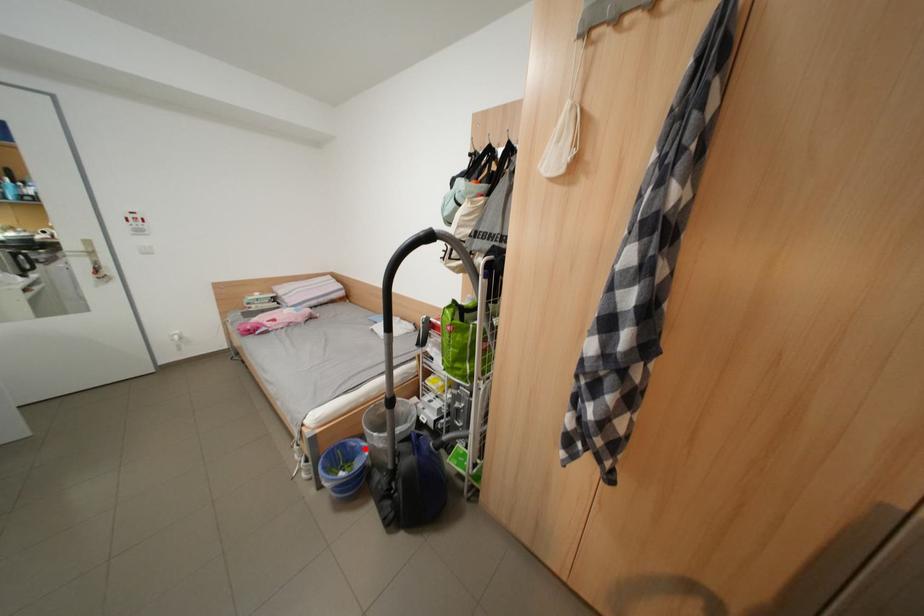
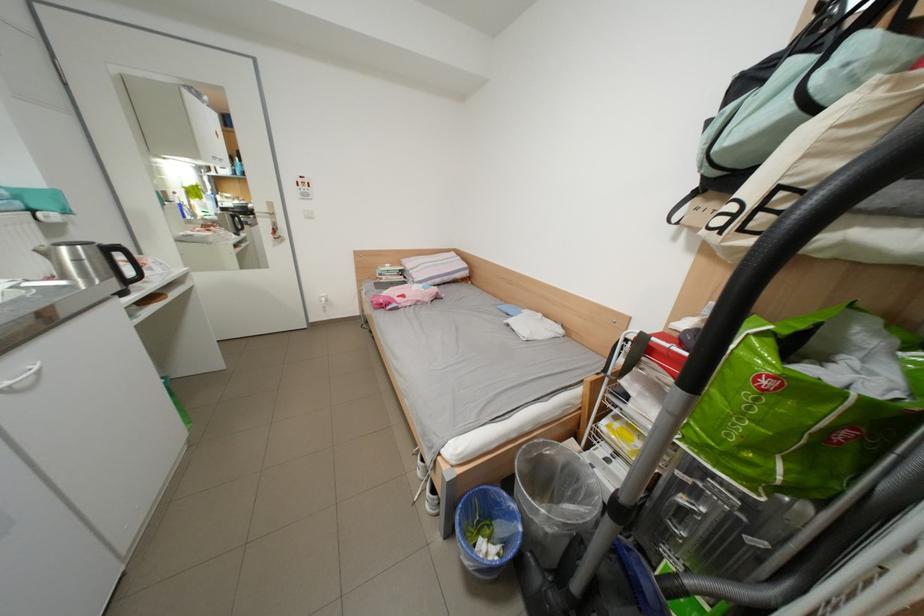
Locate, in the second image, the point that corresponds to the highlighted location in the first image.

(509, 506)